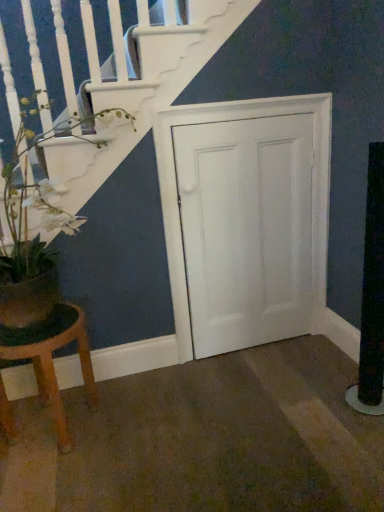
The image size is (384, 512). Find the location of `vacant space to the left of white wood door at center`. vacant space to the left of white wood door at center is located at coordinates 190,378.